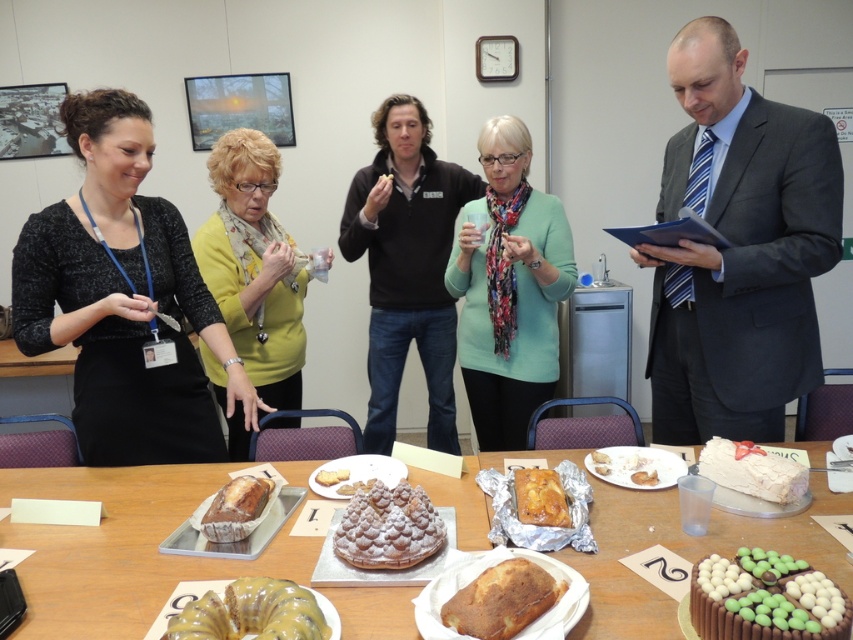
Question: In this image, where is green matte sweater at center located relative to chocolate frosted cake with chocolate candies at center?

Choices:
 (A) left
 (B) right

Answer: (A)

Question: Is yellow sponge cake at center wider than golden crumbly cake at center?

Choices:
 (A) yes
 (B) no

Answer: (A)

Question: Is the position of golden brown cake at center more distant than that of white frosted cake at center?

Choices:
 (A) yes
 (B) no

Answer: (B)

Question: Among these points, which one is farthest from the camera?

Choices:
 (A) (451, 275)
 (B) (631, 464)
 (C) (367, 557)

Answer: (A)

Question: Which object is closer to the camera taking this photo?

Choices:
 (A) glossy yellow cake at center
 (B) yellowmaterial/textureshirt at center
 (C) golden crumbly cake at center
 (D) white frosted cake at lower right

Answer: (A)

Question: Which object is the closest to the yellowmaterial/textureshirt at center?

Choices:
 (A) glossy yellow cake at center
 (B) golden crumbly cake at center
 (C) golden brown cake at center

Answer: (C)